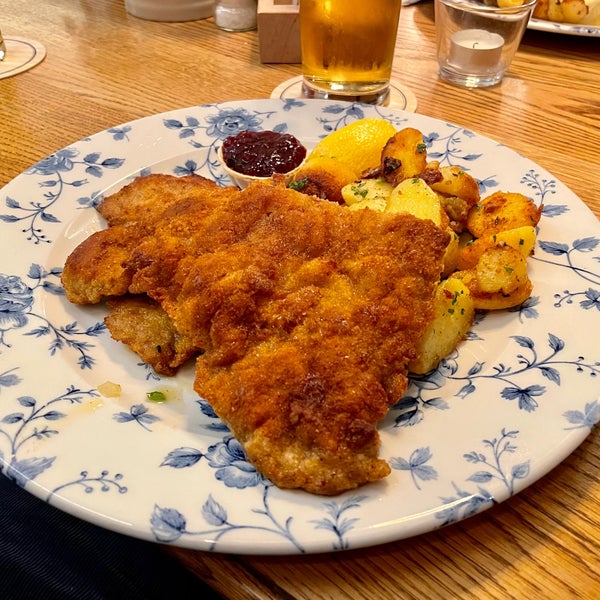
At what (x,y) coordinates should I click in order to perform the action: click on wooden table. Please return your answer as a coordinate pair (x, y). This screenshot has height=600, width=600. Looking at the image, I should click on (587, 128).